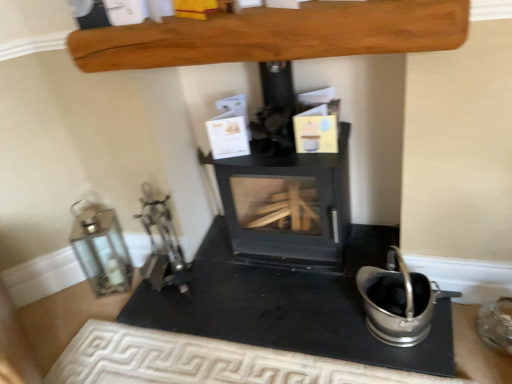
Locate an element on the screen. The height and width of the screenshot is (384, 512). free space above smooth wooden beam at upper center (from a real-world perspective) is located at coordinates (260, 11).